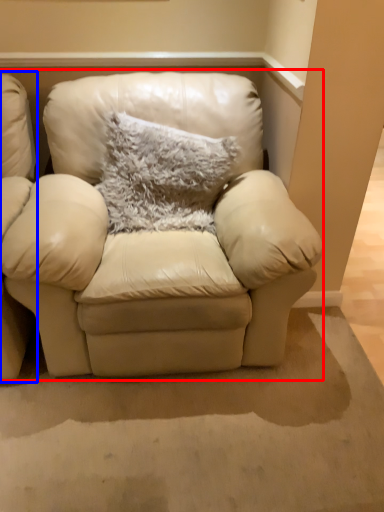
Question: Which object appears closest to the camera in this image, studio couch (highlighted by a red box) or chair (highlighted by a blue box)?

Choices:
 (A) studio couch
 (B) chair

Answer: (B)